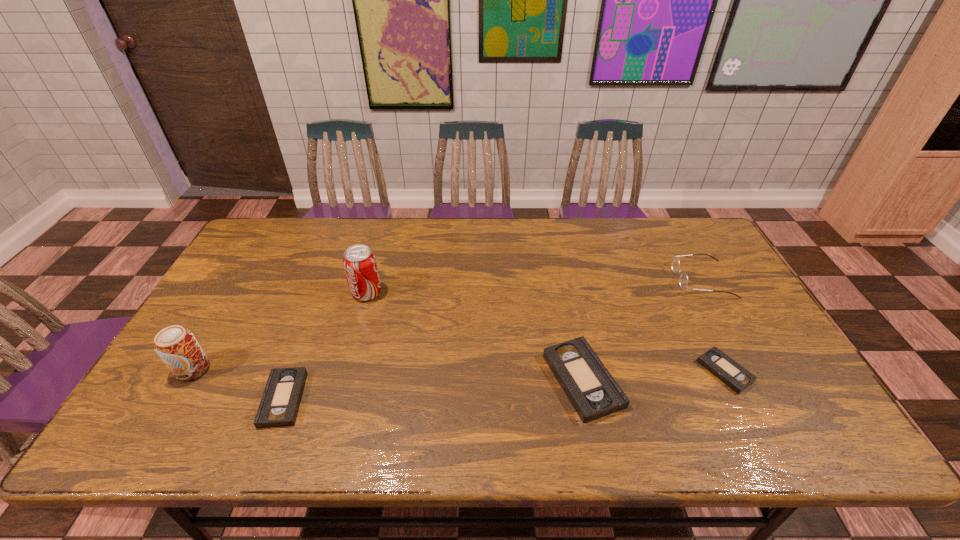
The height and width of the screenshot is (540, 960). Identify the location of object present at the left edge. (177, 347).

The image size is (960, 540). Find the location of `videotape that is at the right edge`. videotape that is at the right edge is located at coordinates (736, 377).

At what (x,y) coordinates should I click in order to perform the action: click on spectacles located in the right edge section of the desktop. Please return your answer as a coordinate pair (x, y). Image resolution: width=960 pixels, height=540 pixels. Looking at the image, I should click on (683, 280).

You are a GUI agent. You are given a task and a screenshot of the screen. Output one action in this format:
    pyautogui.click(x=<x>, y=<y>)
    Task: Click on the object positioned at the near left corner
    
    Given the screenshot: What is the action you would take?
    pyautogui.click(x=177, y=347)

This screenshot has width=960, height=540. I want to click on object positioned at the near right corner, so coord(736,377).

Find the location of a particular element. vacant space at the far edge of the desktop is located at coordinates (352, 228).

The height and width of the screenshot is (540, 960). In the image, there is a desktop. Find the location of `vacant space at the near edge`. vacant space at the near edge is located at coordinates (468, 389).

This screenshot has height=540, width=960. What are the coordinates of `free space at the left edge` in the screenshot? It's located at (246, 287).

This screenshot has width=960, height=540. Find the location of `blank space at the far left corner of the desktop`. blank space at the far left corner of the desktop is located at coordinates (266, 219).

What are the coordinates of `vacant region at the near left corner of the desktop` in the screenshot? It's located at (159, 383).